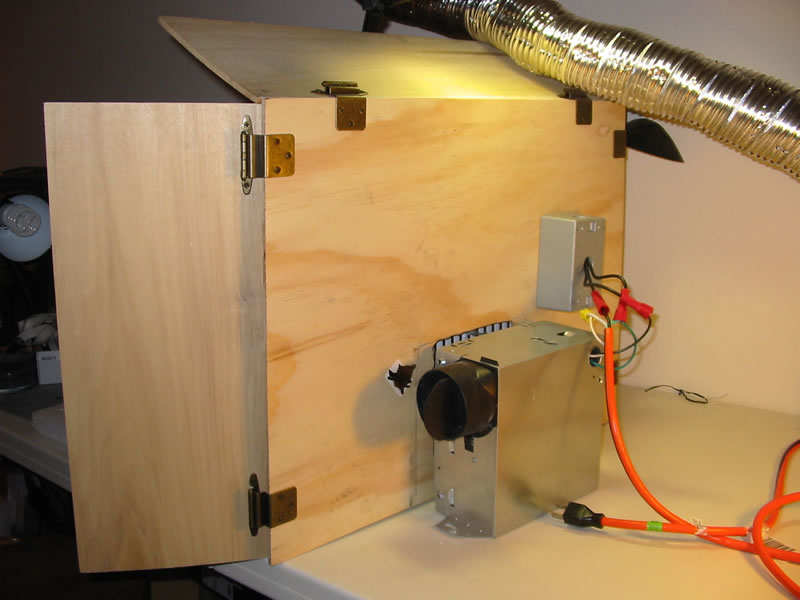
Locate an element on the screen. This screenshot has height=600, width=800. red cable is located at coordinates (708, 533).